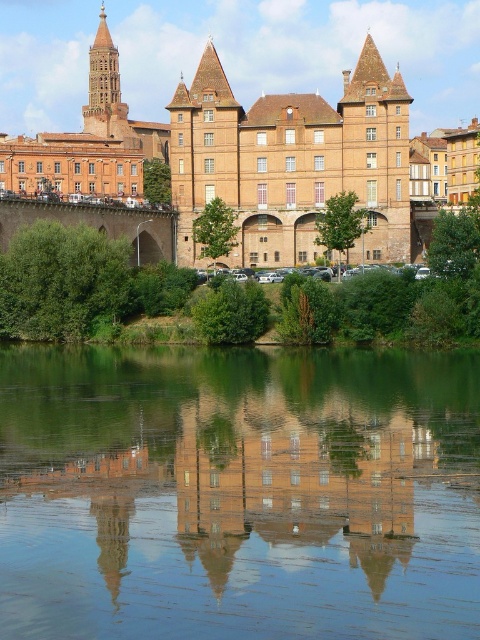
Question: Which point is closer to the camera?

Choices:
 (A) brown brick building at center
 (B) matte brick building at center

Answer: (B)

Question: Can you confirm if green reflective water at center is wider than brown brick building at center?

Choices:
 (A) yes
 (B) no

Answer: (B)

Question: Which object is the farthest from the brown brick building at center?

Choices:
 (A) green reflective water at center
 (B) matte brick building at center

Answer: (A)

Question: Which of the following is the farthest from the observer?

Choices:
 (A) green reflective water at center
 (B) brown brick building at center
 (C) matte brick building at center

Answer: (B)

Question: Where is green reflective water at center located in relation to matte brick building at center in the image?

Choices:
 (A) left
 (B) right

Answer: (A)

Question: Can you confirm if green reflective water at center is positioned to the right of brown brick building at center?

Choices:
 (A) yes
 (B) no

Answer: (B)